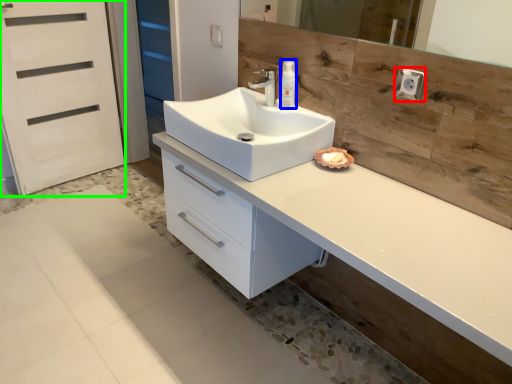
Question: Which object is the farthest from knob (highlighted by a red box)? Choose among these: soap dispenser (highlighted by a blue box) or screen door (highlighted by a green box).

Choices:
 (A) soap dispenser
 (B) screen door

Answer: (B)